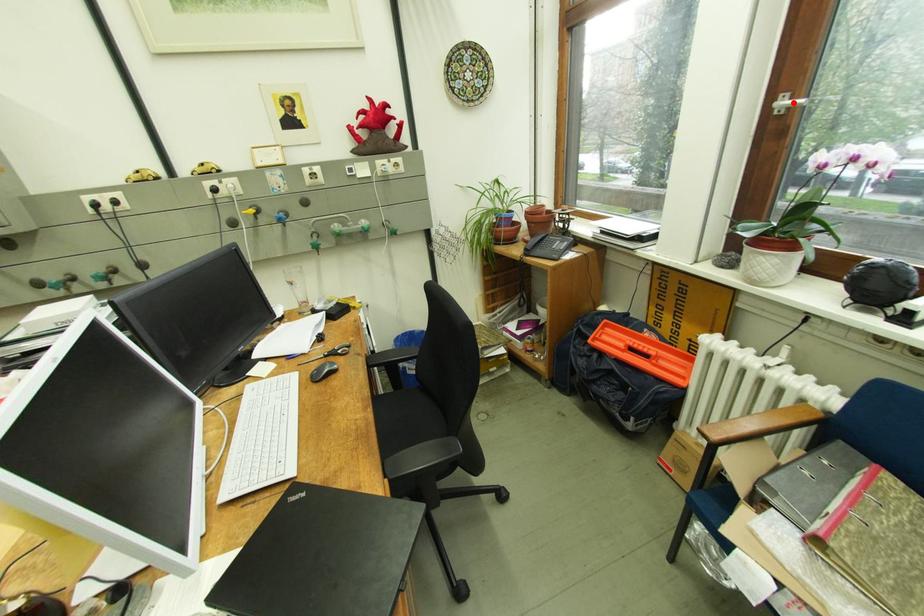
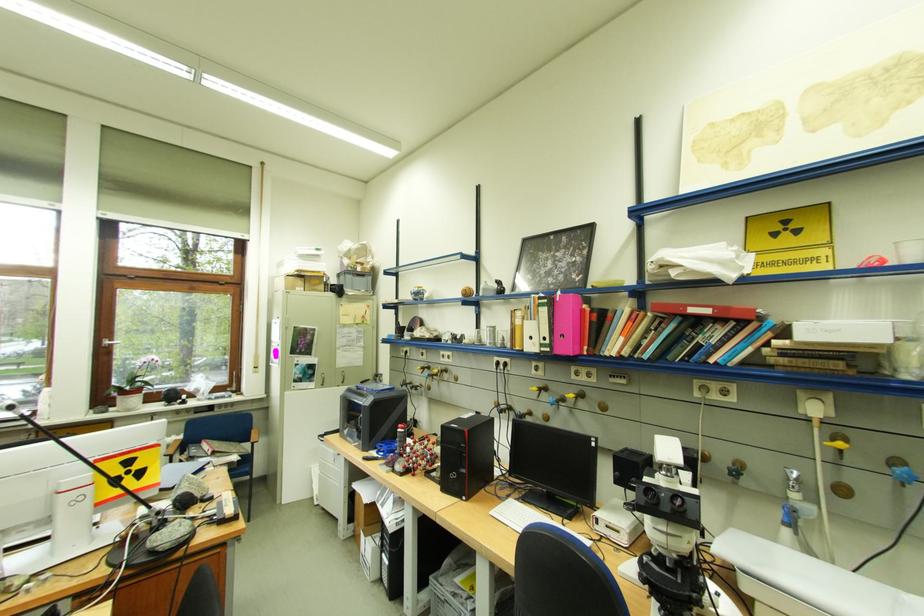
Locate, in the second image, the point that corresponds to the highlighted location in the first image.

(117, 342)